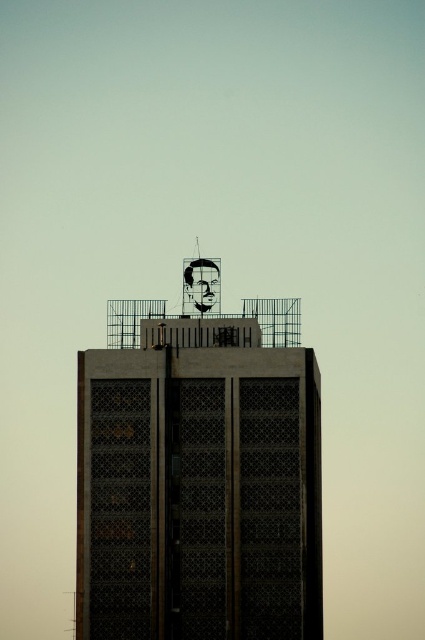
Question: Does metallic grid structure at top appear on the right side of matte black face at top?

Choices:
 (A) no
 (B) yes

Answer: (A)

Question: Can you confirm if metallic grid structure at top is positioned below matte black face at top?

Choices:
 (A) no
 (B) yes

Answer: (B)

Question: Does metallic grid structure at top appear over matte black face at top?

Choices:
 (A) no
 (B) yes

Answer: (A)

Question: Which point is farther from the camera taking this photo?

Choices:
 (A) (155, 337)
 (B) (187, 269)

Answer: (B)